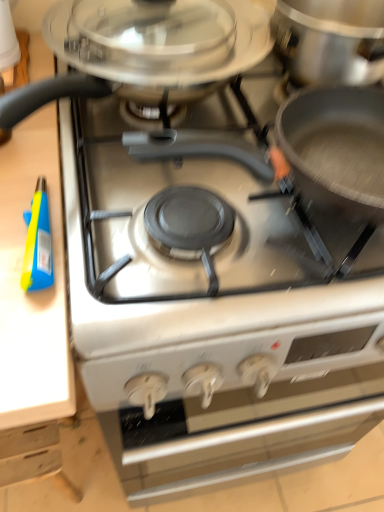
Question: Is point (34, 236) closer or farther from the camera than point (3, 100)?

Choices:
 (A) farther
 (B) closer

Answer: (A)

Question: In terms of height, does blue plastic spray bottle at left look taller or shorter compared to satin silver cooktop at center?

Choices:
 (A) short
 (B) tall

Answer: (A)

Question: Which object is positioned closest to the white matte oven at center?

Choices:
 (A) satin silver cooktop at center
 (B) blue plastic spray bottle at left

Answer: (A)

Question: Which object is the farthest from the white matte oven at center?

Choices:
 (A) blue plastic spray bottle at left
 (B) satin silver cooktop at center

Answer: (A)